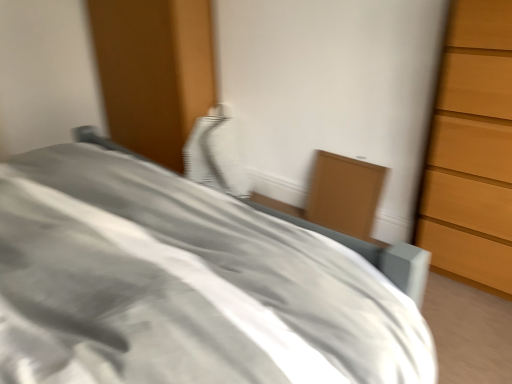
Where is `blank space situated above matte wood cabinet at center-right (from a real-world perspective)`? blank space situated above matte wood cabinet at center-right (from a real-world perspective) is located at coordinates (353, 156).